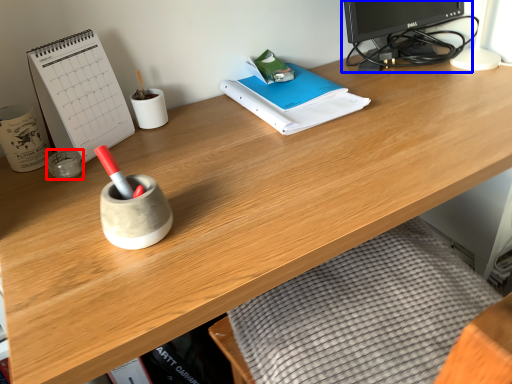
Question: Which of the following is the closest to the observer, stationery (highlighted by a red box) or desktop computer (highlighted by a blue box)?

Choices:
 (A) stationery
 (B) desktop computer

Answer: (A)